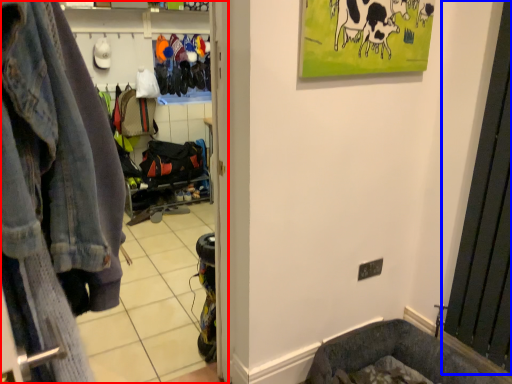
Question: Which point is further to the camera, clothing store (highlighted by a red box) or screen door (highlighted by a blue box)?

Choices:
 (A) clothing store
 (B) screen door

Answer: (B)